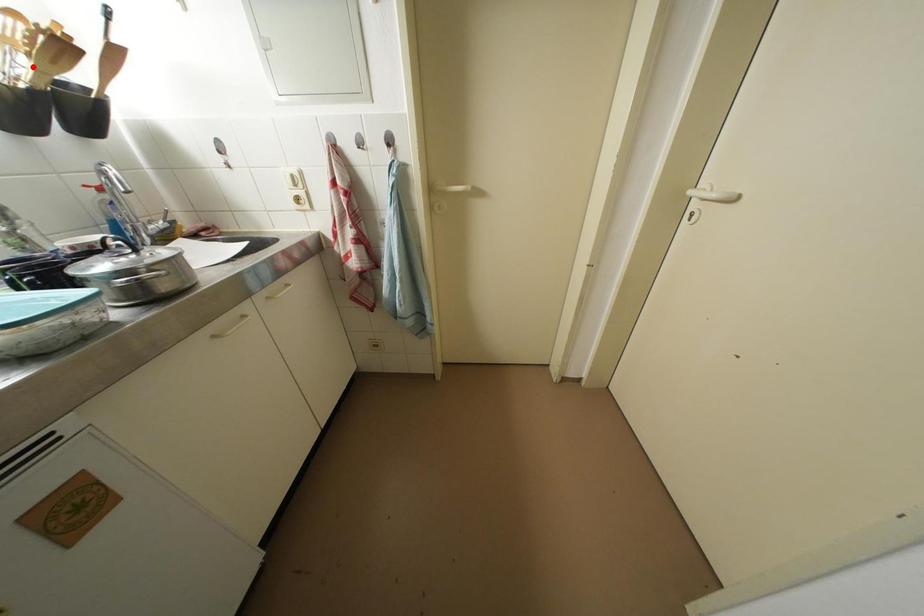
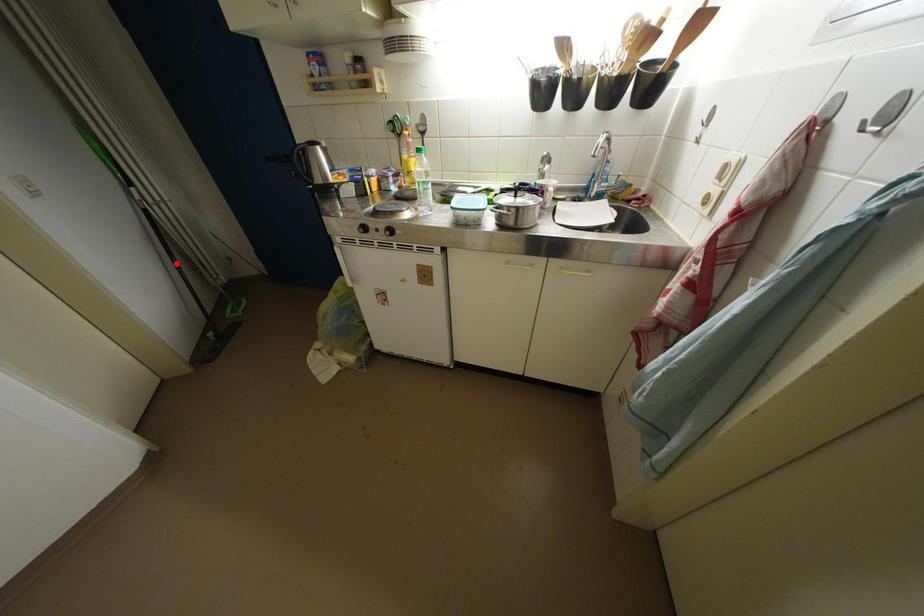
I am providing you with two images of the same scene from different viewpoints. A red point is marked on the first image and another point is marked on the second image. Is the marked point in image1 the same physical position as the marked point in image2?

No